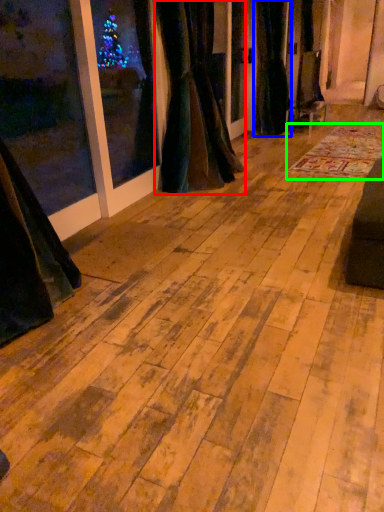
Question: Which object is positioned closest to curtain (highlighted by a red box)? Select from curtain (highlighted by a blue box) and mat (highlighted by a green box).

Choices:
 (A) curtain
 (B) mat

Answer: (B)